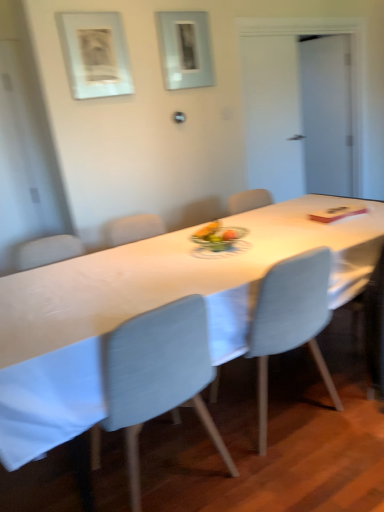
Question: Would you say metallic gray picture frame at upper center, marked as the 2th picture frame in a left-to-right arrangement, contains transparent glass door at upper right?

Choices:
 (A) yes
 (B) no

Answer: (B)

Question: Does metallic gray picture frame at upper center, which is counted as the second picture frame, starting from the front, have a larger size compared to transparent glass door at upper right?

Choices:
 (A) yes
 (B) no

Answer: (B)

Question: Does metallic gray picture frame at upper center, which is counted as the second picture frame, starting from the front, come in front of transparent glass door at upper right?

Choices:
 (A) no
 (B) yes

Answer: (B)

Question: Can you confirm if metallic gray picture frame at upper center, positioned as the 1th picture frame in right-to-left order, is thinner than transparent glass door at upper right?

Choices:
 (A) yes
 (B) no

Answer: (A)

Question: Is metallic gray picture frame at upper center, placed as the 1th picture frame when sorted from back to front, smaller than transparent glass door at upper right?

Choices:
 (A) no
 (B) yes

Answer: (B)

Question: Is metallic gray picture frame at upper center, marked as the 2th picture frame in a left-to-right arrangement, at the left side of transparent glass door at upper right?

Choices:
 (A) no
 (B) yes

Answer: (B)

Question: Is white glossy table at center wider than light blue fabric chair at center, the 1th chair when ordered from left to right?

Choices:
 (A) no
 (B) yes

Answer: (B)

Question: Considering the relative sizes of white glossy table at center and light blue fabric chair at center, which appears as the second chair when viewed from the right, in the image provided, is white glossy table at center smaller than light blue fabric chair at center, which appears as the second chair when viewed from the right,?

Choices:
 (A) no
 (B) yes

Answer: (A)

Question: Can you confirm if white glossy table at center is taller than light blue fabric chair at center, which appears as the second chair when viewed from the right?

Choices:
 (A) yes
 (B) no

Answer: (B)

Question: Is white glossy table at center touching light blue fabric chair at center, the 1th chair when ordered from left to right?

Choices:
 (A) no
 (B) yes

Answer: (A)

Question: Can you confirm if white glossy table at center is positioned to the right of light blue fabric chair at center, the 1th chair when ordered from left to right?

Choices:
 (A) yes
 (B) no

Answer: (A)

Question: Can we say white glossy table at center lies outside light blue fabric chair at center, the 1th chair when ordered from left to right?

Choices:
 (A) yes
 (B) no

Answer: (A)

Question: Can you confirm if white glossy table at center is positioned to the left of metallic gray picture frame at upper center, marked as the 2th picture frame in a left-to-right arrangement?

Choices:
 (A) no
 (B) yes

Answer: (A)